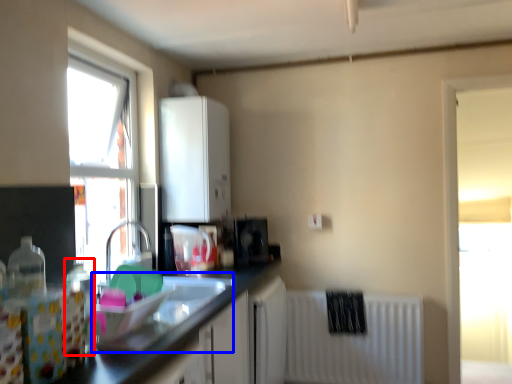
Question: Which of the following is the farthest to the observer, bottle (highlighted by a red box) or sink (highlighted by a blue box)?

Choices:
 (A) bottle
 (B) sink

Answer: (B)